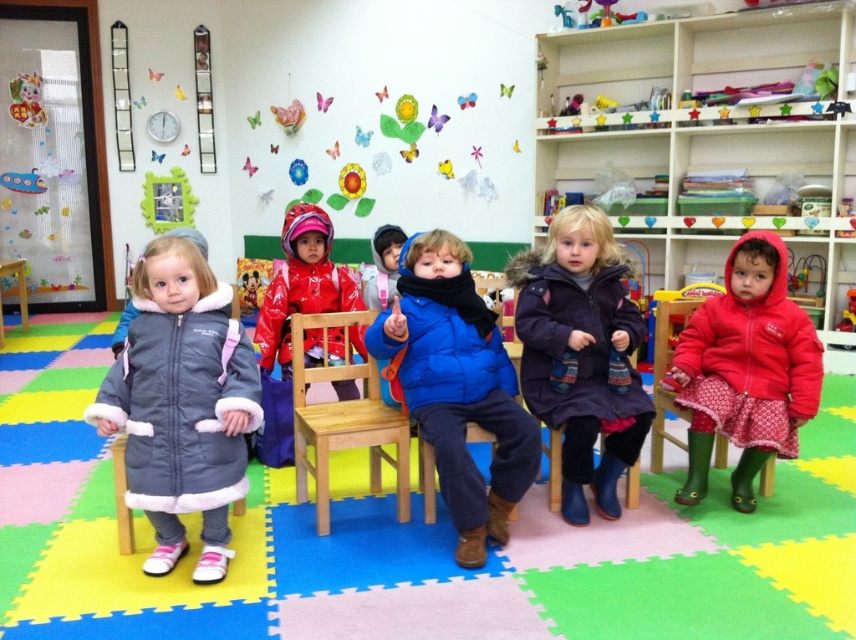
Which is above, gray fleece coat at left or light brown wooden chair at center?

Positioned higher is gray fleece coat at left.

Is gray fleece coat at left in front of light brown wooden chair at center?

Yes, gray fleece coat at left is closer to the viewer.

Image resolution: width=856 pixels, height=640 pixels. I want to click on gray fleece coat at left, so click(182, 403).

This screenshot has height=640, width=856. I want to click on gray fleece coat at left, so click(182, 403).

Which is behind, point (156, 520) or point (336, 381)?

The point (336, 381) is more distant.

Is point (171, 492) less distant than point (343, 385)?

Yes.

Is point (199, 340) positioned after point (290, 305)?

No, (199, 340) is in front of (290, 305).

The height and width of the screenshot is (640, 856). What are the coordinates of `gray fleece coat at left` in the screenshot? It's located at (182, 403).

Where is `purple fuzzy coat at center`? Image resolution: width=856 pixels, height=640 pixels. purple fuzzy coat at center is located at coordinates (581, 353).

Consider the image. Does purple fuzzy coat at center appear on the left side of blue fleece jacket at center?

In fact, purple fuzzy coat at center is to the right of blue fleece jacket at center.

This screenshot has height=640, width=856. What are the coordinates of `purple fuzzy coat at center` in the screenshot? It's located at (581, 353).